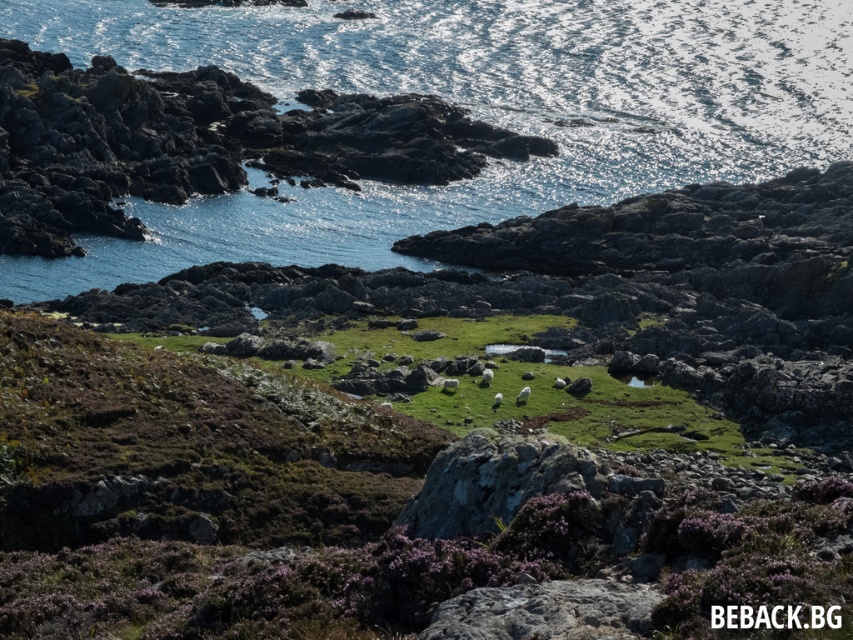
You are a hiker planning to cross from the gray rough rock at lower center to the clear water at upper center. Given that your maximum safe distance for a jump is 200 feet, can you safely make the jump?

The clear water at upper center and gray rough rock at lower center are 233.80 feet apart. Since your maximum safe jump distance is 200 feet, you cannot safely make the jump as the distance exceeds your limit.

You are standing on the gray rough rock at lower center and want to reach the green grass at center. Which direction should you move to get there?

You should move to the right because the green grass at center is located to the right of the gray rough rock at lower center.

You are a hiker who wants to cross from the rocky terrain to the grassy area where the sheep are grazing. You see the clear water at upper center and the gray rough rock at lower center. Which object should you step on to avoid getting your feet wet?

You should step on the gray rough rock at lower center because it is located below the clear water at upper center, making it a dry and stable surface to cross on.